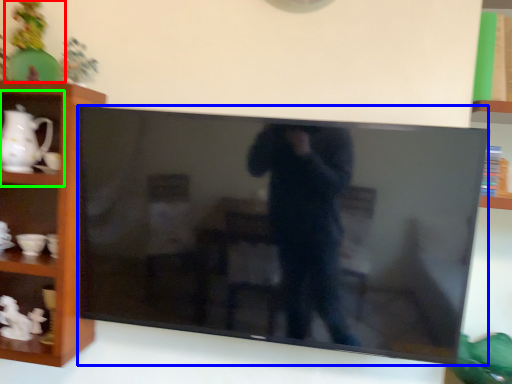
Question: Based on their relative distances, which object is nearer to toy (highlighted by a red box)? Choose from television (highlighted by a blue box) and cabinet (highlighted by a green box).

Choices:
 (A) television
 (B) cabinet

Answer: (B)